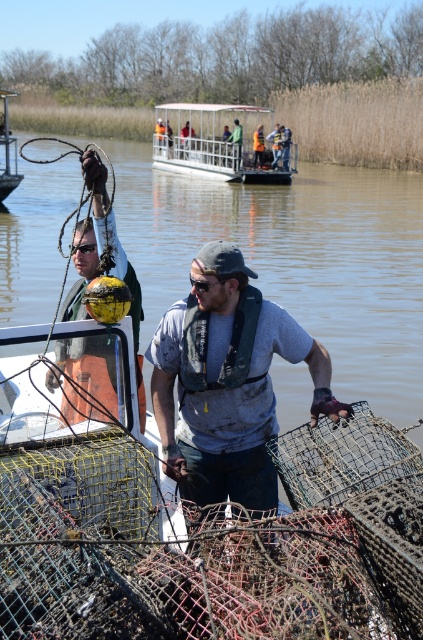
Question: Does yellow rubber buoy at left appear over orange reflective vest at center?

Choices:
 (A) no
 (B) yes

Answer: (A)

Question: Which object is closer to the camera taking this photo?

Choices:
 (A) yellow rubber buoy at left
 (B) metallic yellow buoy at left
 (C) white plastic boat at upper center
 (D) orange reflective vest at center

Answer: (A)

Question: Which point appears farthest from the camera in this image?

Choices:
 (A) (25, 225)
 (B) (2, 93)
 (C) (255, 502)

Answer: (B)

Question: Does yellow rubber buoy at left have a lesser width compared to metallic yellow buoy at left?

Choices:
 (A) yes
 (B) no

Answer: (B)

Question: Does white plastic boat at upper center appear over metallic yellow buoy at left?

Choices:
 (A) yes
 (B) no

Answer: (A)

Question: Which point is farther to the camera?

Choices:
 (A) (192, 125)
 (B) (216, 454)
 (C) (131, 147)

Answer: (C)